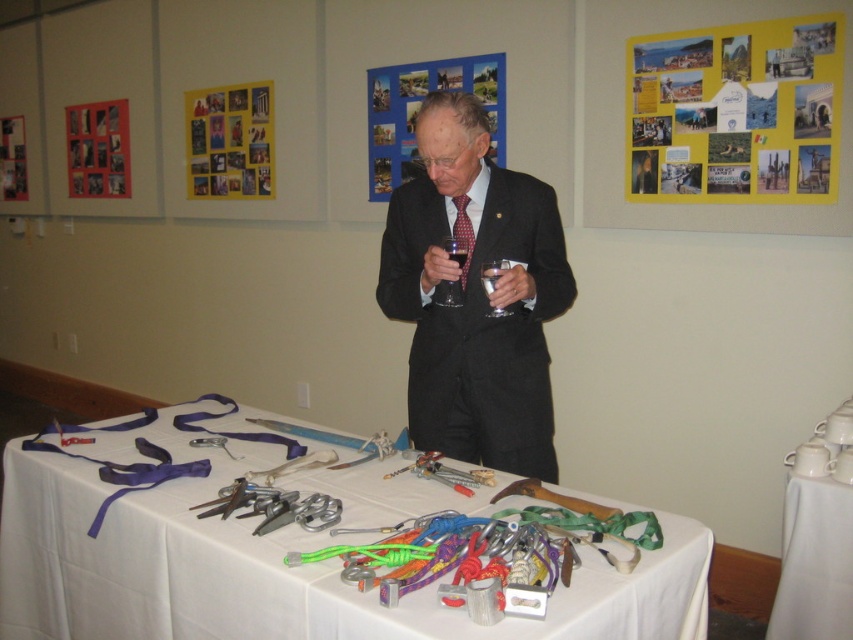
You are standing at the origin point of the coordinate system in the image. You need to place a new object at the same position as the white fabric table at lower right. What coordinates should you use?

The white fabric table at lower right is located at coordinates point (817, 536), so you should place the new object at the same coordinates point (817, 536).

Please provide the 2D coordinates of the red checkered tie at center in the image. The coordinates should be in the format of a point with two decimal places, such as point X, Y.

The 2D coordinates of the red checkered tie at center are point (463, 232).